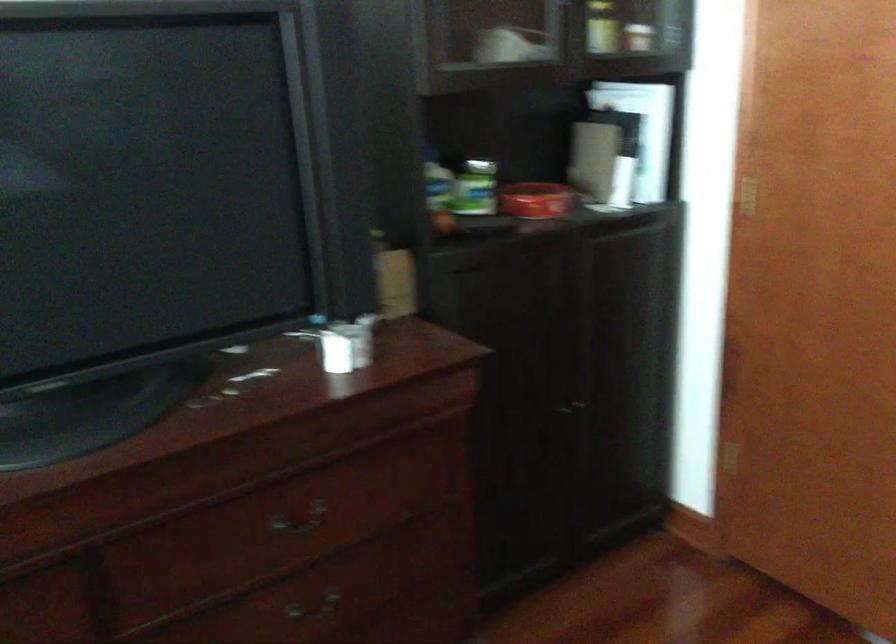
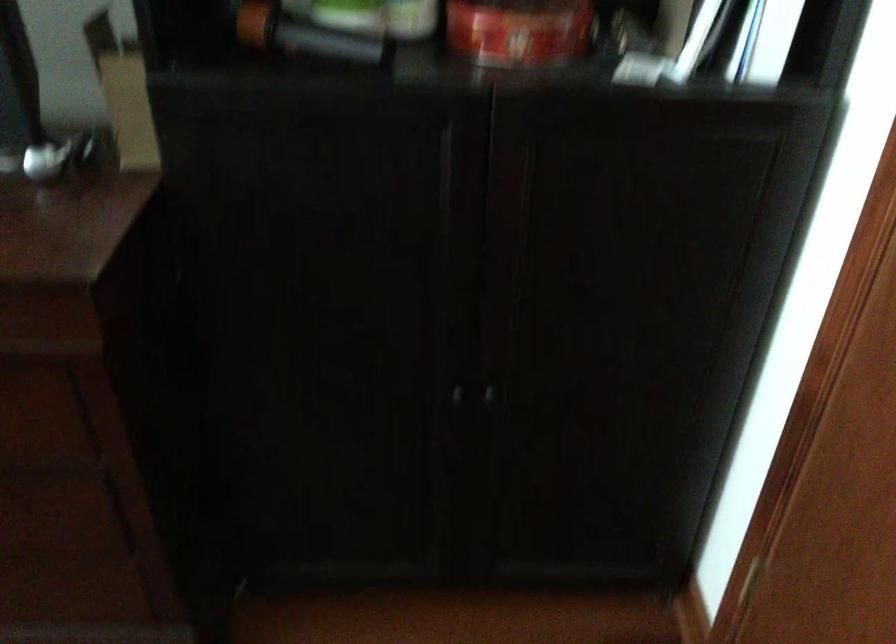
In the second image, find the point that corresponds to point (563, 415) in the first image.

(457, 395)